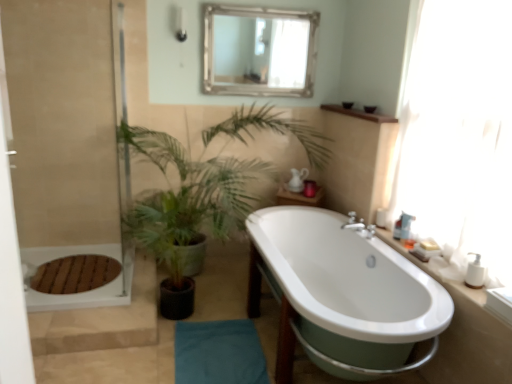
Identify the location of wooden shelf at upper center, the first counter top in the back-to-front sequence. 359,114.

Where is `white ceramic sink at right, which is counted as the 1th counter top, starting from the front`? white ceramic sink at right, which is counted as the 1th counter top, starting from the front is located at coordinates (453, 280).

Image resolution: width=512 pixels, height=384 pixels. Describe the element at coordinates (260, 51) in the screenshot. I see `silver/golden frame mirror at upper center` at that location.

Where is `beige textured screen door at left`? Image resolution: width=512 pixels, height=384 pixels. beige textured screen door at left is located at coordinates (65, 138).

Where is `white plastic pump bottle at right, which ranks as the first toiletry in right-to-left order`? white plastic pump bottle at right, which ranks as the first toiletry in right-to-left order is located at coordinates (475, 273).

Locate an element on the screen. This screenshot has width=512, height=384. window that appears above the white plastic soap dispenser at right, the 1th toiletry positioned from the left (from a real-world perspective) is located at coordinates (460, 135).

From the image's perspective, which is above, transparent glass window at right or white plastic soap dispenser at right, the 1th toiletry positioned from the left?

From the image's view, transparent glass window at right is above.

Between transparent glass window at right and white plastic soap dispenser at right, the 1th toiletry viewed from the back, which one has smaller size?

Smaller between the two is white plastic soap dispenser at right, the 1th toiletry viewed from the back.

Between point (451, 77) and point (378, 219), which one is positioned in front?

The point (451, 77) is more forward.

Are transparent glass window at right and white ceramic sink at right, which is counted as the 1th counter top, starting from the front, located far from each other?

They are positioned close to each other.

Between transparent glass window at right and white ceramic sink at right, which is the second counter top from back to front, which one is positioned behind?

white ceramic sink at right, which is the second counter top from back to front, is further away from the camera.

Is transparent glass window at right aimed at white ceramic sink at right, the second counter top positioned from the top?

No, transparent glass window at right does not turn towards white ceramic sink at right, the second counter top positioned from the top.

What's the angular difference between transparent glass window at right and white ceramic sink at right, which is the second counter top from back to front,'s facing directions?

0.274 degrees separate the facing orientations of transparent glass window at right and white ceramic sink at right, which is the second counter top from back to front.

Does white plastic soap dispenser at right, the 3th toiletry from the front, have a greater width compared to white plastic pump bottle at right, which ranks as the first toiletry in right-to-left order?

Indeed, white plastic soap dispenser at right, the 3th toiletry from the front, has a greater width compared to white plastic pump bottle at right, which ranks as the first toiletry in right-to-left order.

How distant is white plastic soap dispenser at right, the 3th toiletry from the front, from white plastic pump bottle at right, the third toiletry when ordered from left to right?

The distance of white plastic soap dispenser at right, the 3th toiletry from the front, from white plastic pump bottle at right, the third toiletry when ordered from left to right, is 30.06 inches.

Is point (377, 220) less distant than point (482, 273)?

No.

Is matte white shower at upper left surrounded by wooden shelf at upper center, the first counter top in the back-to-front sequence?

That's incorrect, matte white shower at upper left is not inside wooden shelf at upper center, the first counter top in the back-to-front sequence.

Considering the positions of objects wooden shelf at upper center, the first counter top in the back-to-front sequence, and matte white shower at upper left in the image provided, who is more to the left, wooden shelf at upper center, the first counter top in the back-to-front sequence, or matte white shower at upper left?

matte white shower at upper left is more to the left.

Considering their positions, is wooden shelf at upper center, the first counter top positioned from the top, located in front of or behind matte white shower at upper left?

Visually, wooden shelf at upper center, the first counter top positioned from the top, is located in front of matte white shower at upper left.

Between point (180, 36) and point (79, 207), which one is positioned behind?

Positioned behind is point (79, 207).

Is matte white shower at upper left bigger than beige textured screen door at left?

No.

From the image's perspective, is matte white shower at upper left beneath beige textured screen door at left?

Incorrect, from the image's perspective, matte white shower at upper left is higher than beige textured screen door at left.

Visually, is matte white shower at upper left positioned to the left or to the right of beige textured screen door at left?

Based on their positions, matte white shower at upper left is located to the right of beige textured screen door at left.

Can you confirm if silver/golden frame mirror at upper center is positioned to the right of white glossy bathtub at center?

No.

Is silver/golden frame mirror at upper center not near white glossy bathtub at center?

Absolutely, silver/golden frame mirror at upper center is distant from white glossy bathtub at center.

Would you say silver/golden frame mirror at upper center contains white glossy bathtub at center?

No, white glossy bathtub at center is not surrounded by silver/golden frame mirror at upper center.

Which of these two, silver/golden frame mirror at upper center or white glossy bathtub at center, is smaller?

Smaller between the two is silver/golden frame mirror at upper center.

Considering the positions of objects matte white shower at upper left and white plastic soap dispenser at right, arranged as the 3th toiletry when viewed from the right, in the image provided, who is in front, matte white shower at upper left or white plastic soap dispenser at right, arranged as the 3th toiletry when viewed from the right,?

white plastic soap dispenser at right, arranged as the 3th toiletry when viewed from the right.

You are a GUI agent. You are given a task and a screenshot of the screen. Output one action in this format:
    pyautogui.click(x=<x>, y=<y>)
    Task: Click on the shower above the white plastic soap dispenser at right, the 1th toiletry viewed from the back (from the image's perspective)
    The image size is (512, 384).
    Given the screenshot: What is the action you would take?
    181,25

Does matte white shower at upper left have a lesser width compared to white plastic soap dispenser at right, the 1th toiletry positioned from the left?

No, matte white shower at upper left is not thinner than white plastic soap dispenser at right, the 1th toiletry positioned from the left.

Are matte white shower at upper left and white plastic soap dispenser at right, the 3th toiletry from the front, beside each other?

There is a gap between matte white shower at upper left and white plastic soap dispenser at right, the 3th toiletry from the front.

The height and width of the screenshot is (384, 512). Find the location of `toiletry that is the 1st one when counting downward from the transparent glass window at right (from the image's perspective)`. toiletry that is the 1st one when counting downward from the transparent glass window at right (from the image's perspective) is located at coordinates (381, 218).

Find the location of a particular element. This screenshot has height=384, width=512. window above the white ceramic sink at right, which is counted as the 1th counter top, starting from the front (from a real-world perspective) is located at coordinates click(460, 135).

Considering their positions, is matte white shower at upper left positioned closer to beige textured screen door at left than white plastic soap dispenser at right, the 3th toiletry from the front?

The object closer to beige textured screen door at left is matte white shower at upper left.

From the picture: When comparing their distances from beige textured screen door at left, does wooden shelf at upper center, which ranks as the second counter top in front-to-back order, or blue fabric bath mat at lower center seem closer?

Among the two, blue fabric bath mat at lower center is located nearer to beige textured screen door at left.

Which object lies nearer to the anchor point transparent glass window at right, green leafy plant at center or beige textured screen door at left?

green leafy plant at center.

Estimate the real-world distances between objects in this image. Which object is further from matte white shower at upper left, white glossy bathtub at center or white plastic soap dispenser at right, the 1th toiletry viewed from the back?

The object further to matte white shower at upper left is white glossy bathtub at center.

Looking at the image, which one is located closer to white ceramic sink at right, the second counter top positioned from the top, beige textured screen door at left or wooden shelf at upper center, the first counter top positioned from the top?

wooden shelf at upper center, the first counter top positioned from the top, is positioned closer to the anchor white ceramic sink at right, the second counter top positioned from the top.

Based on their spatial positions, is white ceramic sink at right, which is counted as the 1th counter top, starting from the front, or transparent glass window at right closer to beige textured screen door at left?

transparent glass window at right is positioned closer to the anchor beige textured screen door at left.

Based on their spatial positions, is beige textured screen door at left or translucent plastic soap dispenser at right, the second toiletry positioned from the left, further from silver/golden frame mirror at upper center?

Based on the image, translucent plastic soap dispenser at right, the second toiletry positioned from the left, appears to be further to silver/golden frame mirror at upper center.

Based on their spatial positions, is matte white shower at upper left or white ceramic sink at right, the second counter top positioned from the top, closer to white plastic pump bottle at right, which ranks as the first toiletry in front-to-back order?

white ceramic sink at right, the second counter top positioned from the top, lies closer to white plastic pump bottle at right, which ranks as the first toiletry in front-to-back order, than the other object.

The image size is (512, 384). I want to click on window between beige textured screen door at left and white plastic pump bottle at right, the third toiletry when ordered from left to right, in the horizontal direction, so click(460, 135).

The width and height of the screenshot is (512, 384). Identify the location of bathtub positioned between transparent glass window at right and white plastic soap dispenser at right, arranged as the 3th toiletry when viewed from the right, from near to far. (342, 292).

In order to click on bath mat located between beige textured screen door at left and white plastic soap dispenser at right, the 1th toiletry viewed from the back, in the left-right direction in this screenshot , I will do `click(219, 353)`.

At what (x,y) coordinates should I click in order to perform the action: click on bathtub between beige textured screen door at left and white plastic soap dispenser at right, arranged as the 3th toiletry when viewed from the right, from left to right. Please return your answer as a coordinate pair (x, y). The image size is (512, 384). Looking at the image, I should click on (342, 292).